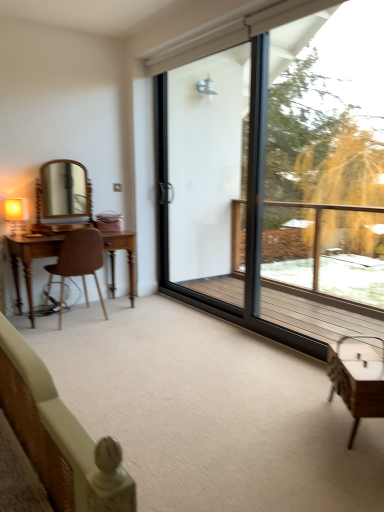
Identify the location of free location to the left of white glossy table at lower right, which is counted as the second table, starting from the back. Image resolution: width=384 pixels, height=512 pixels. 307,419.